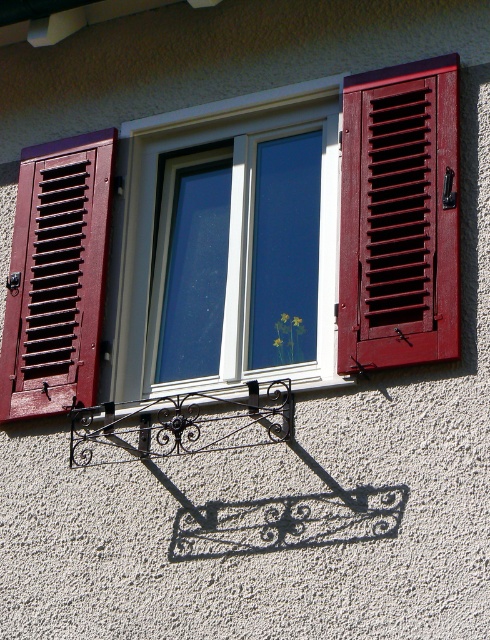
You are standing in front of the window with red wooden shutters. There are two points marked on the window frame. The first point is at coordinates point [273,104] and the second point is at coordinates point [104,266]. If you were to draw a straight line from your eyes to each point, which point would be closer to you?

Point [104,266] is closer to you because it is in front of point [273,104] according to their spatial arrangement.

You are a painter standing 30 inches away from the matte white window frame at center. You want to paint the matte wood shutter at right without moving closer. Can you reach it with your 28 inch long paintbrush?

The matte white window frame at center is 26.27 inches away from the matte wood shutter at right. Since you are 30 inches away from the window frame, the total distance to the shutter is 30 inches plus 26.27 inches, totaling 56.27 inches. Your paintbrush is only 28 inches long, so you cannot reach the matte wood shutter at right without moving closer.